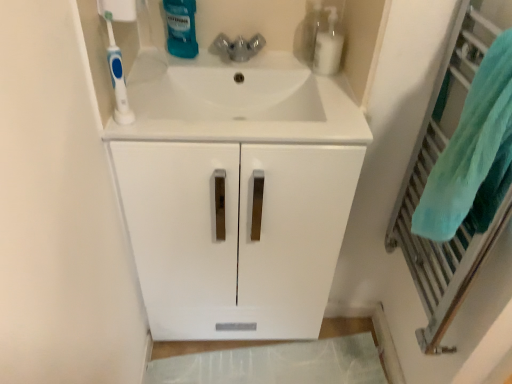
At what (x,y) coordinates should I click in order to perform the action: click on free space between translucent plastic mouthwash at upper center, the first cleaning product positioned from the left, and clear plastic bottle at upper right, the 1th cleaning product positioned from the right. Please return your answer as a coordinate pair (x, y). Looking at the image, I should click on (236, 63).